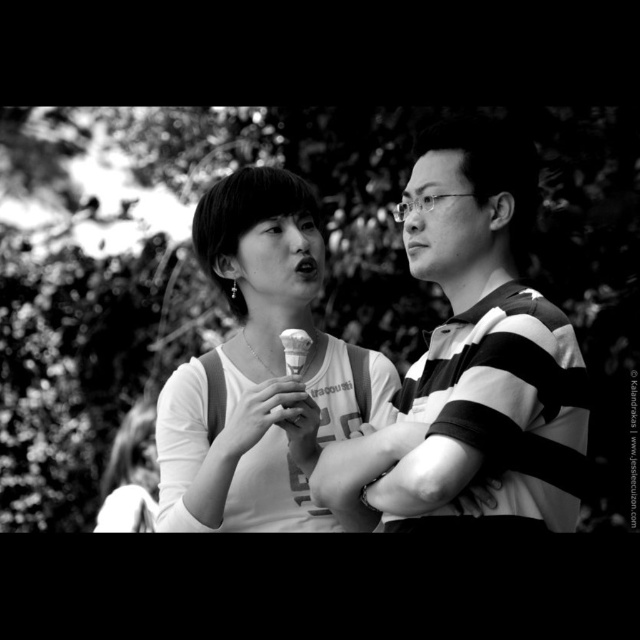
Question: Is striped fabric shirt at right thinner than white paper ice cream cone at center?

Choices:
 (A) no
 (B) yes

Answer: (A)

Question: Can you confirm if matte white tank top at center is bigger than white paper ice cream cone at center?

Choices:
 (A) no
 (B) yes

Answer: (B)

Question: Observing the image, what is the correct spatial positioning of matte white tank top at center in reference to white paper ice cream cone at center?

Choices:
 (A) below
 (B) above

Answer: (B)

Question: Which point appears farthest from the camera in this image?

Choices:
 (A) (524, 179)
 (B) (307, 337)
 (C) (364, 401)

Answer: (C)

Question: Which point is closer to the camera taking this photo?

Choices:
 (A) (301, 336)
 (B) (422, 225)

Answer: (B)

Question: Among these points, which one is nearest to the camera?

Choices:
 (A) (180, 426)
 (B) (486, 460)
 (C) (301, 352)

Answer: (B)